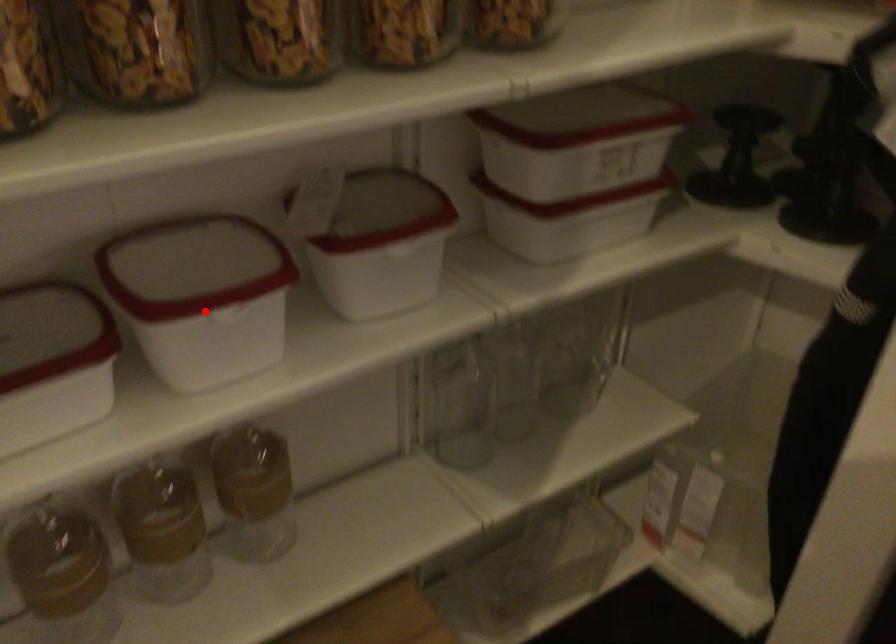
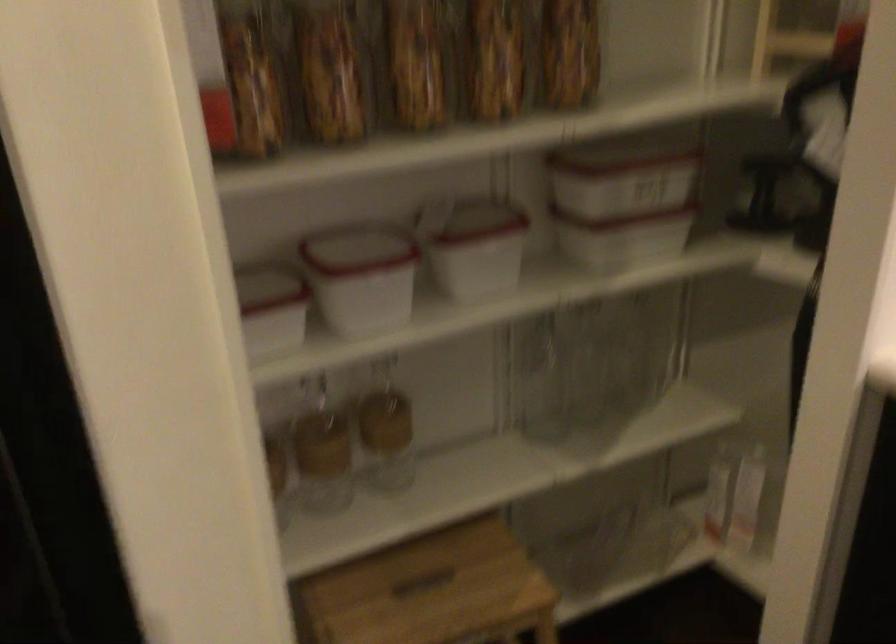
Find the pixel in the second image that matches the highlighted location in the first image.

(362, 277)